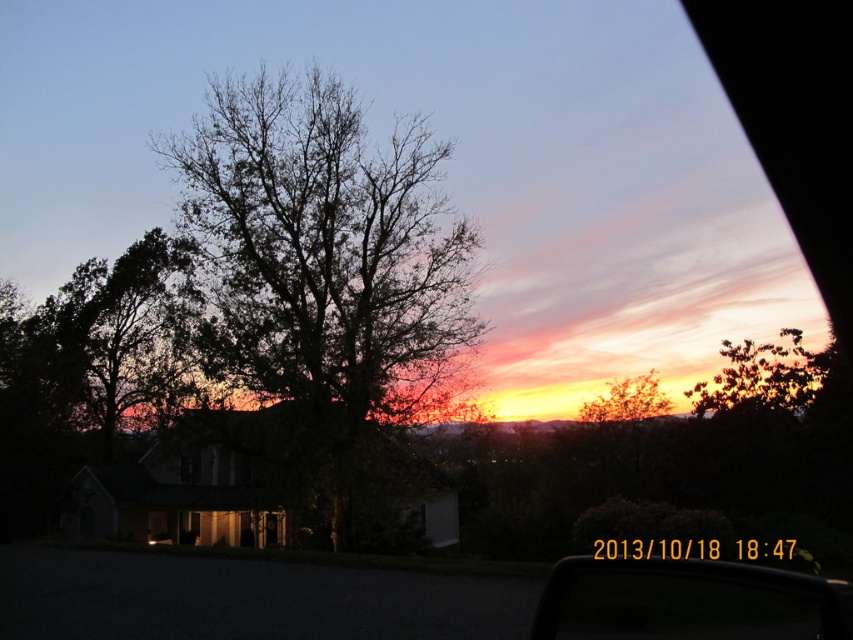
Question: Which point is farther to the camera?

Choices:
 (A) dark green leafy tree at center
 (B) dark green leafy tree at left
 (C) transparent glass car window at center

Answer: (B)

Question: Which of the following is the closest to the observer?

Choices:
 (A) click(624, 400)
 (B) click(53, 384)
 (C) click(845, 621)
 (D) click(802, 369)

Answer: (C)

Question: In this image, where is dark green leafy tree at center located relative to transparent glass car window at center?

Choices:
 (A) left
 (B) right

Answer: (A)

Question: Which object is closer to the camera taking this photo?

Choices:
 (A) green leafy tree at upper right
 (B) dark green leafy tree at left

Answer: (B)

Question: Considering the relative positions of transparent glass car window at center and silhouette leafy tree at upper right in the image provided, where is transparent glass car window at center located with respect to silhouette leafy tree at upper right?

Choices:
 (A) above
 (B) below

Answer: (B)

Question: Where is dark green leafy tree at left located in relation to silhouette leafy tree at upper right in the image?

Choices:
 (A) above
 (B) below

Answer: (A)